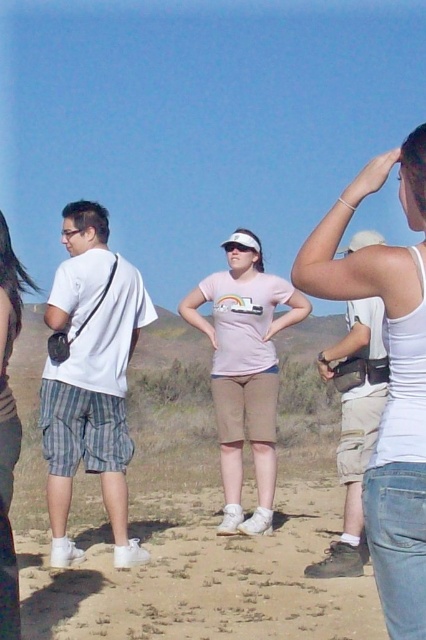
You are planning to buy a new shirt and want to know which one is wider between the white tank top at upper right and the white cotton shirt at left. Can you tell me?

The white tank top at upper right might be wider than white cotton shirt at left according to the description.